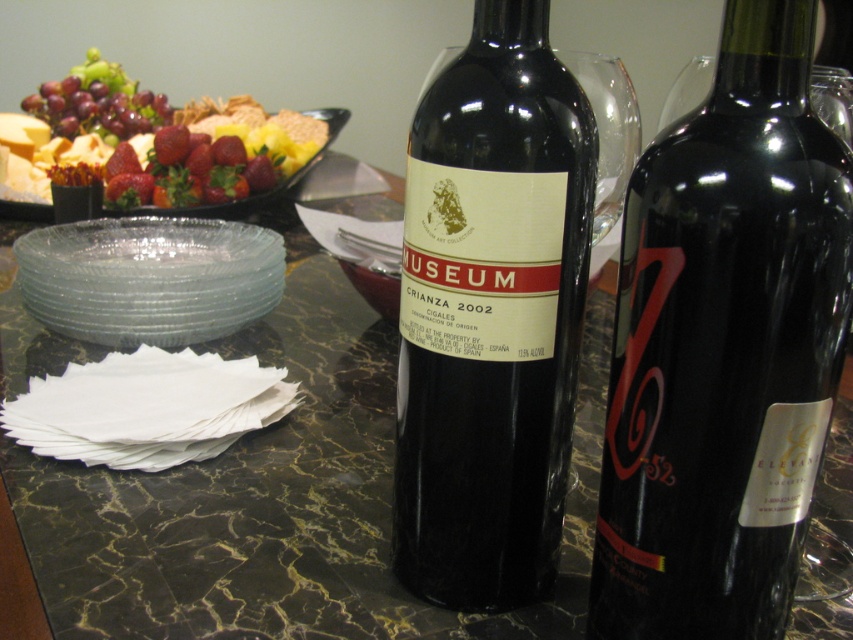
Question: Which of the following is the farthest from the observer?

Choices:
 (A) shiny red strawberries at upper left
 (B) shiny red grapes at upper left

Answer: (B)

Question: Which object appears farthest from the camera in this image?

Choices:
 (A) shiny red grapes at upper left
 (B) black glass bottle at center
 (C) shiny red strawberries at upper left

Answer: (A)

Question: Which object appears farthest from the camera in this image?

Choices:
 (A) matte black wine bottle at center
 (B) glassy clear platter at upper left
 (C) shiny red strawberries at upper left

Answer: (B)

Question: Does matte black wine bottle at center appear over shiny red strawberries at upper left?

Choices:
 (A) no
 (B) yes

Answer: (A)

Question: Is black glass bottle at center wider than matte black wine bottle at center?

Choices:
 (A) yes
 (B) no

Answer: (A)

Question: Can you confirm if black glass bottle at center is positioned to the left of matte black wine bottle at center?

Choices:
 (A) no
 (B) yes

Answer: (A)